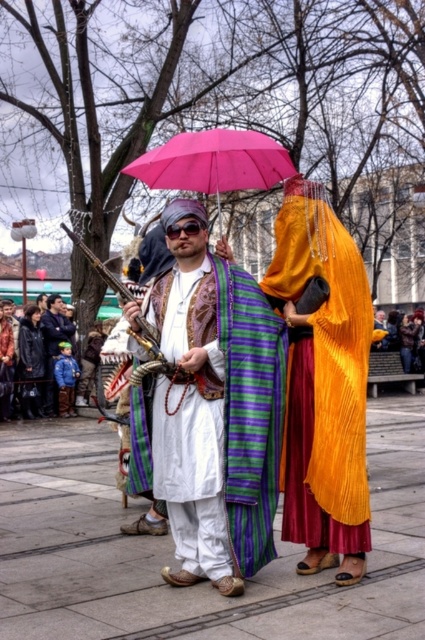
Does smooth concrete pavement at center have a greater width compared to matte purple striped robe at center?

Yes.

Does smooth concrete pavement at center have a greater height compared to matte purple striped robe at center?

No.

Which is in front, point (138, 502) or point (241, 397)?

Point (241, 397)

At what (x,y) coordinates should I click in order to perform the action: click on smooth concrete pavement at center. Please return your answer as a coordinate pair (x, y). Looking at the image, I should click on (172, 548).

This screenshot has height=640, width=425. Identify the location of matte purple striped robe at center. (215, 408).

Does matte purple striped robe at center come in front of blue denim jacket at lower left?

That is True.

Measure the distance between point (x=153, y=314) and camera.

Point (x=153, y=314) and camera are 11.83 meters apart from each other.

Find the location of `matte purple striped robe at center`. matte purple striped robe at center is located at coordinates (215, 408).

Is blue denim jacket at lower left closer to the viewer compared to leather jacket at center?

Yes, it is.

Is blue denim jacket at lower left further to the viewer compared to leather jacket at center?

No, it is not.

Is point (51, 296) farther from viewer compared to point (405, 339)?

No, it is not.

Find the location of a particular element. blue denim jacket at lower left is located at coordinates (53, 344).